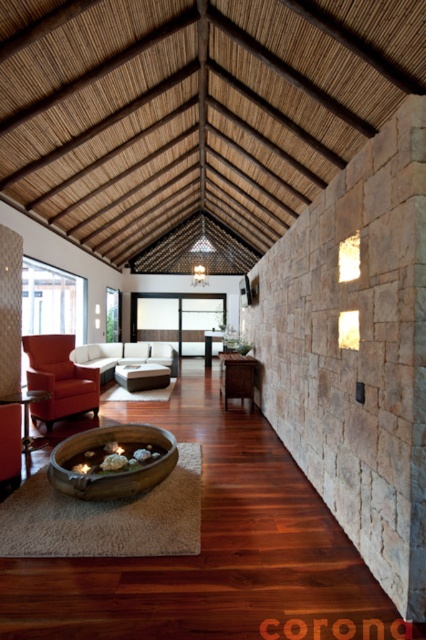
You are arranging a small potted plant that is 15 cm wide. You want to place it on either the brown wood cabinet at center or the matte gray ottoman at center. Based on their widths, which surface can accommodate the plant without overhanging?

The matte gray ottoman at center is wider than the brown wood cabinet at center, so the potted plant can be placed on the matte gray ottoman at center as it has enough width to accommodate the 15 cm wide plant without overhanging.

What are the coordinates of the brown wooden fire pit at center?

The coordinates of the brown wooden fire pit at center are at point (112, 468).

You are planning to place a 2.5 meter long sofa between the brown wooden fire pit at center and the matte wood coffee table at center. Can the sofa fit in the space between them?

The distance between the brown wooden fire pit at center and the matte wood coffee table at center is 7.30 meters. Since the sofa is 2.5 meters long, there is sufficient space as 7.30 meters is greater than 2.5 meters. The sofa can fit comfortably between them.